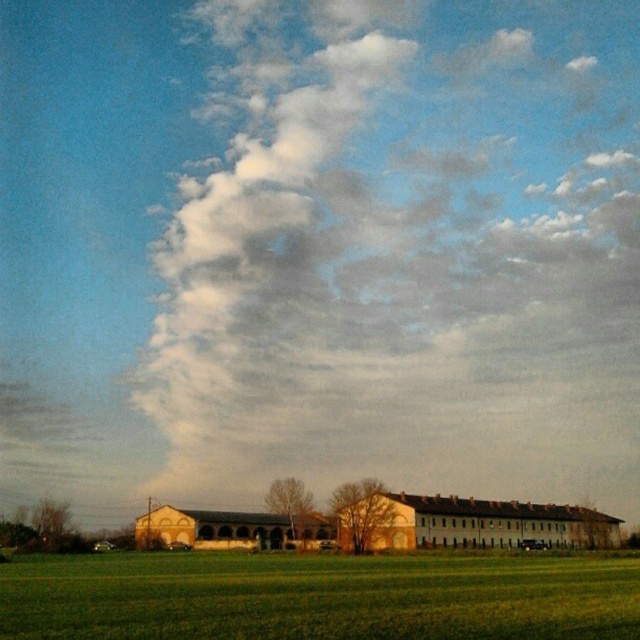
You are standing in the middle of the field looking at the beige brick barn at center and the white fluffy cloud at upper center. Which object is higher in the sky?

The white fluffy cloud at upper center is higher in the sky than the beige brick barn at center because it is positioned above it.

You are standing at the point closest to the viewer in the image. Which point, point (324, 326) or point (416, 506), is farther away from you?

Point (324, 326) is behind point (416, 506), so it is farther away from you.

You are standing in the middle of the field and see both the beige brick barn at center and the brown textured barn at center. If you want to reach the nearest barn first, which one should you head towards?

Both the beige brick barn at center and the brown textured barn at center are the same structure, so there is no nearest barn to choose between them. You can head towards either since they are the same.